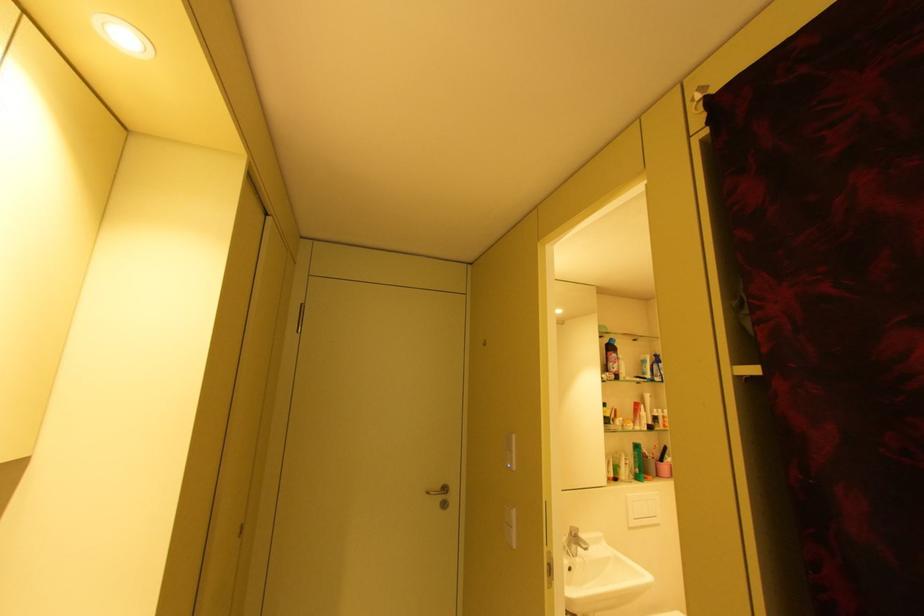
You are a GUI agent. You are given a task and a screenshot of the screen. Output one action in this format:
    pyautogui.click(x=<x>, y=<y>)
    Task: Click on the sink faucet handle
    This screenshot has height=616, width=924.
    Given the screenshot: What is the action you would take?
    pyautogui.click(x=573, y=532)